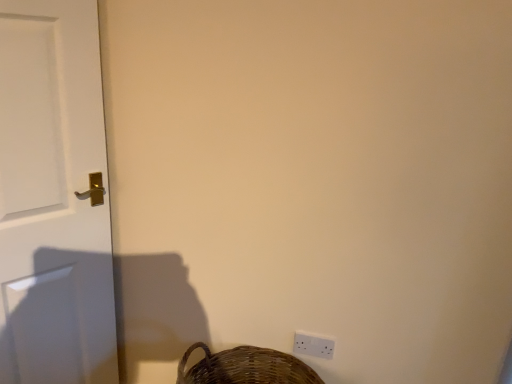
Question: From the image's perspective, is white plastic light switch at lower right above brown woven basket at lower right?

Choices:
 (A) yes
 (B) no

Answer: (A)

Question: From the image's perspective, is white plastic light switch at lower right beneath brown woven basket at lower right?

Choices:
 (A) yes
 (B) no

Answer: (B)

Question: Does white plastic light switch at lower right have a lesser width compared to brown woven basket at lower right?

Choices:
 (A) no
 (B) yes

Answer: (B)

Question: Is brown woven basket at lower right completely or partially inside white plastic light switch at lower right?

Choices:
 (A) no
 (B) yes

Answer: (A)

Question: Considering the relative sizes of white plastic light switch at lower right and brown woven basket at lower right in the image provided, is white plastic light switch at lower right shorter than brown woven basket at lower right?

Choices:
 (A) no
 (B) yes

Answer: (B)

Question: From the image's perspective, relative to brown woven basket at lower right, is white glossy door at left above or below?

Choices:
 (A) below
 (B) above

Answer: (B)

Question: Is white glossy door at left spatially inside brown woven basket at lower right, or outside of it?

Choices:
 (A) inside
 (B) outside

Answer: (B)

Question: Is point (50, 370) positioned closer to the camera than point (252, 350)?

Choices:
 (A) farther
 (B) closer

Answer: (B)

Question: Is white glossy door at left to the left or to the right of brown woven basket at lower right in the image?

Choices:
 (A) right
 (B) left

Answer: (B)

Question: Looking at their shapes, would you say brown woven basket at lower right is wider or thinner than white plastic light switch at lower right?

Choices:
 (A) thin
 (B) wide

Answer: (B)

Question: Visually, is brown woven basket at lower right positioned to the left or to the right of white plastic light switch at lower right?

Choices:
 (A) right
 (B) left

Answer: (B)

Question: Is point (210, 369) positioned closer to the camera than point (302, 332)?

Choices:
 (A) farther
 (B) closer

Answer: (A)

Question: Do you think brown woven basket at lower right is within white plastic light switch at lower right, or outside of it?

Choices:
 (A) inside
 (B) outside

Answer: (B)

Question: Considering the positions of brown woven basket at lower right and white glossy door at left in the image, is brown woven basket at lower right wider or thinner than white glossy door at left?

Choices:
 (A) thin
 (B) wide

Answer: (B)

Question: Is point (186, 372) closer or farther from the camera than point (81, 286)?

Choices:
 (A) closer
 (B) farther

Answer: (B)